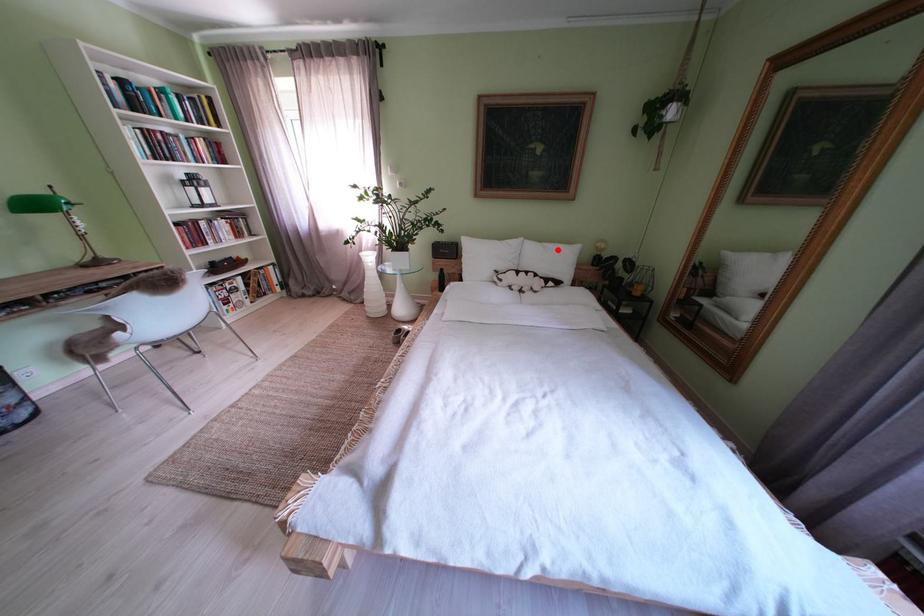
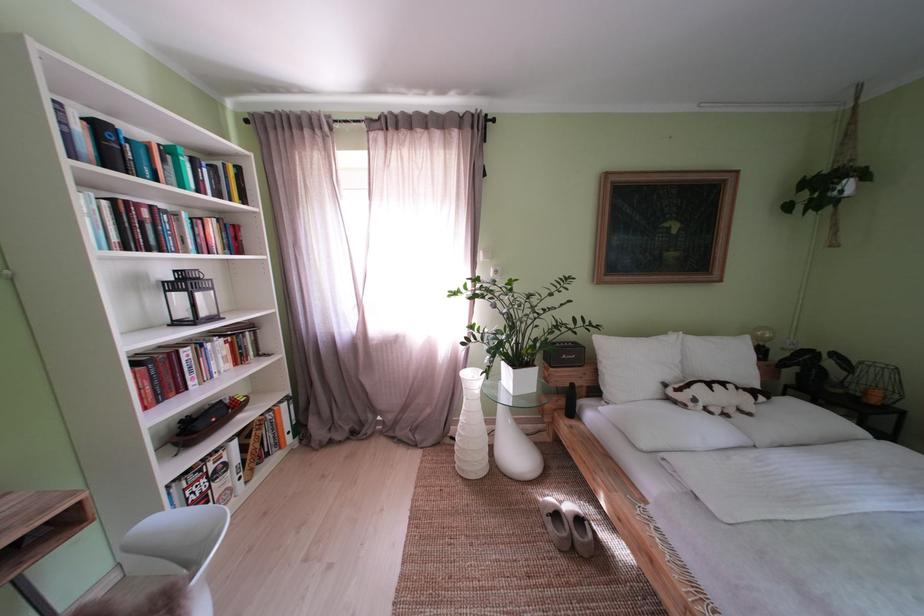
In the second image, find the point that corresponds to the highlighted location in the first image.

(723, 344)